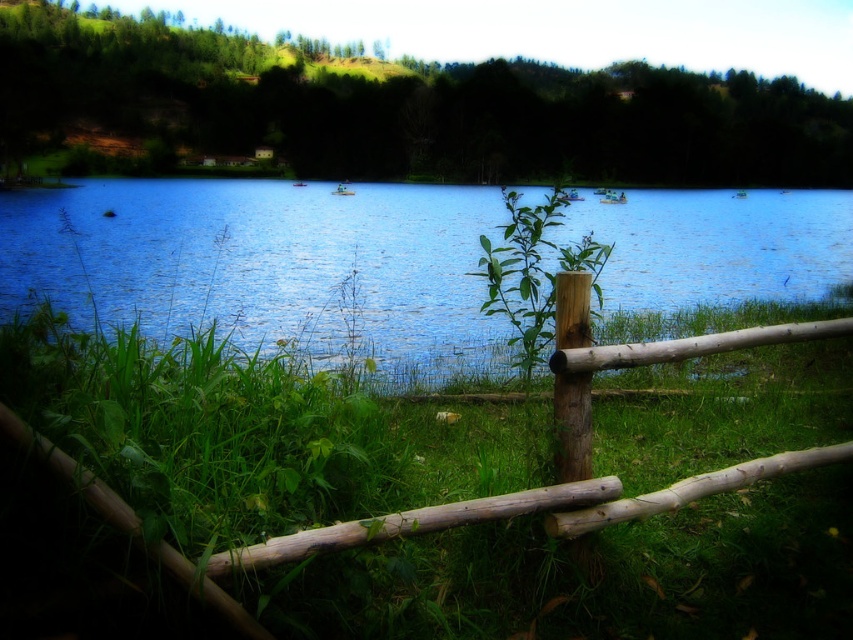
Question: Which of the following is the farthest from the observer?

Choices:
 (A) green rough grass at lower center
 (B) green leafy plant at center

Answer: (B)

Question: Which point is closer to the camera taking this photo?

Choices:
 (A) (514, 250)
 (B) (821, 609)

Answer: (B)

Question: Does green rough grass at lower center appear on the left side of green leafy plant at center?

Choices:
 (A) no
 (B) yes

Answer: (B)

Question: Can you confirm if blue water at center is bigger than green leafy plant at center?

Choices:
 (A) no
 (B) yes

Answer: (B)

Question: Which object is closer to the camera taking this photo?

Choices:
 (A) blue water at center
 (B) green leafy plant at center

Answer: (B)

Question: Is green rough grass at lower center wider than green leafy plant at center?

Choices:
 (A) yes
 (B) no

Answer: (B)